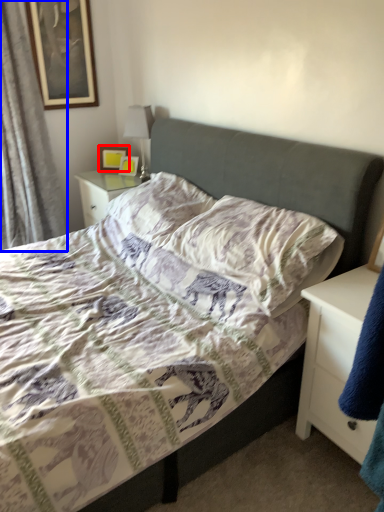
Question: Which of the following is the farthest to the observer, picture frame (highlighted by a red box) or curtain (highlighted by a blue box)?

Choices:
 (A) picture frame
 (B) curtain

Answer: (A)